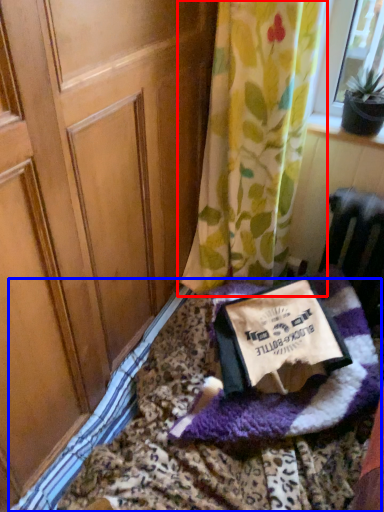
Question: Which object is closer to the camera taking this photo, curtain (highlighted by a red box) or bedding (highlighted by a blue box)?

Choices:
 (A) curtain
 (B) bedding

Answer: (B)